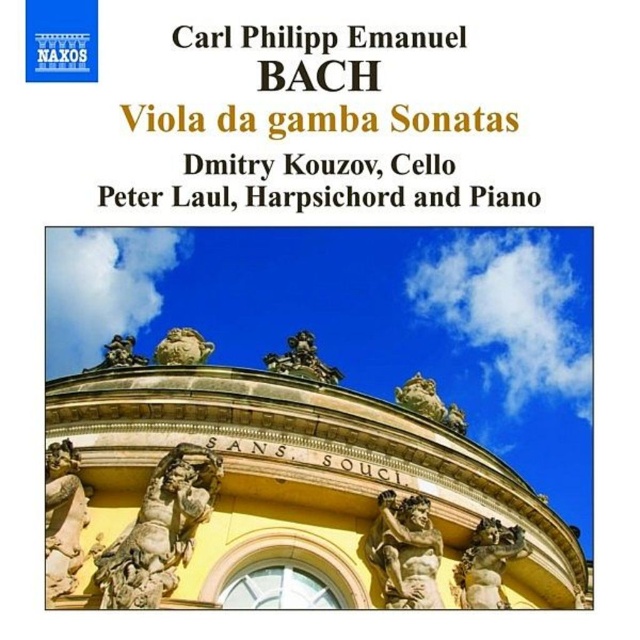
Question: Which point is farther to the camera?

Choices:
 (A) (381, 525)
 (B) (452, 422)
 (C) (60, 502)

Answer: (B)

Question: Is yellow stone building at center smaller than polished stone statue at lower left?

Choices:
 (A) no
 (B) yes

Answer: (A)

Question: Is stone statue at center further to the viewer compared to polished stone lion at center?

Choices:
 (A) yes
 (B) no

Answer: (B)

Question: Which of the following is the closest to the observer?

Choices:
 (A) bronze statue at center
 (B) golden stone statue at center
 (C) polished bronze statue at center
 (D) polished stone statue at lower left

Answer: (D)

Question: Which of these objects is positioned farthest from the golden stone statue at center?

Choices:
 (A) bronze statue at center
 (B) stone statue at center
 (C) polished stone statue at lower left
 (D) polished bronze statue at center

Answer: (D)

Question: Is polished stone lion at center positioned in front of gold stone statue at center?

Choices:
 (A) no
 (B) yes

Answer: (B)